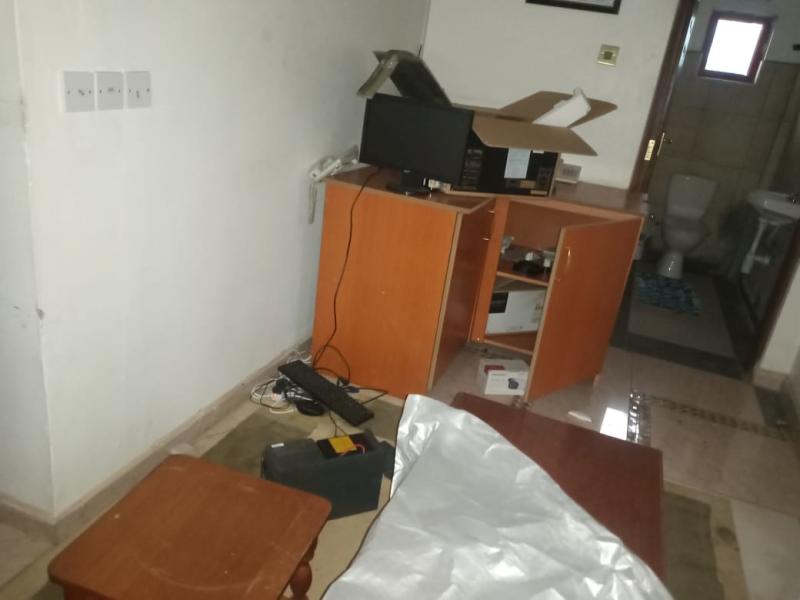
At what (x,y) coordinates should I click in order to perform the action: click on tables. Please return your answer as a coordinate pair (x, y). Looking at the image, I should click on (217, 563), (602, 460).